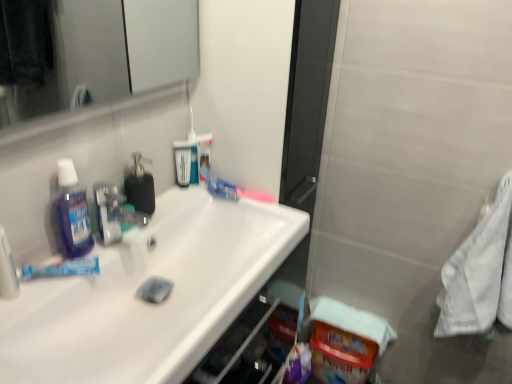
The width and height of the screenshot is (512, 384). What are the coordinates of `space that is in front of blue matte toothpaste at left` in the screenshot? It's located at (35, 309).